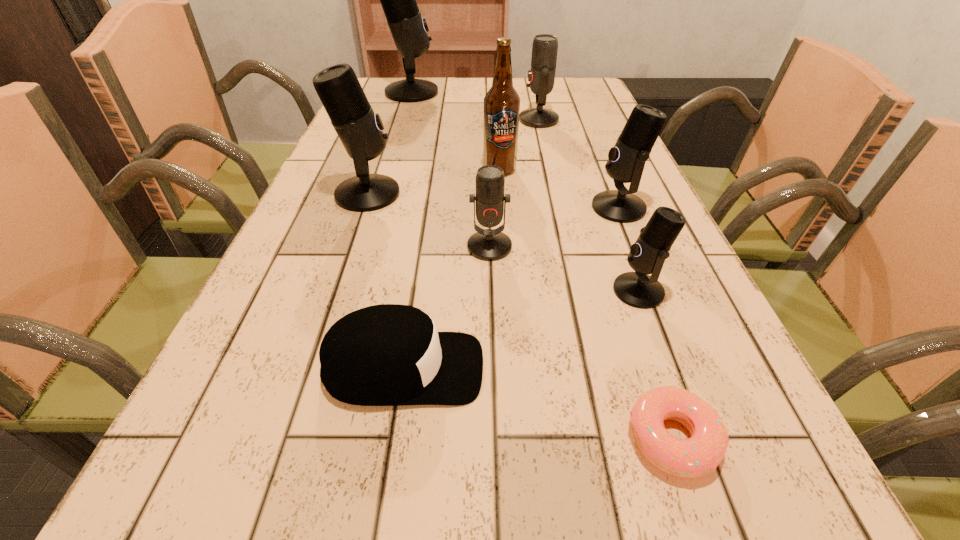
Where is `black microphone identified as the third closest to the cap`? The image size is (960, 540). black microphone identified as the third closest to the cap is located at coordinates (626, 160).

Where is `black microphone that is the third closest to the beer bottle`? The width and height of the screenshot is (960, 540). black microphone that is the third closest to the beer bottle is located at coordinates (647, 255).

Where is `vacant space that satisfies the following two spatial constraints: 1. on the stand of the nearest black microphone; 2. on the front side of the doughnut`? The height and width of the screenshot is (540, 960). vacant space that satisfies the following two spatial constraints: 1. on the stand of the nearest black microphone; 2. on the front side of the doughnut is located at coordinates [693, 438].

I want to click on blank space that satisfies the following two spatial constraints: 1. on the side of the second farthest microphone with the red ring; 2. on the label of the beer bottle, so click(x=550, y=170).

Where is `free point that satisfies the following two spatial constraints: 1. on the side of the doughnut with the red ring; 2. on the right side of the left red microphone`? free point that satisfies the following two spatial constraints: 1. on the side of the doughnut with the red ring; 2. on the right side of the left red microphone is located at coordinates (494, 438).

Locate an element on the screen. Image resolution: width=960 pixels, height=540 pixels. blank space that satisfies the following two spatial constraints: 1. on the side of the farther red microphone with the red ring; 2. on the side of the second nearest microphone with the red ring is located at coordinates (568, 247).

Locate an element on the screen. This screenshot has height=540, width=960. free spot that satisfies the following two spatial constraints: 1. on the label of the beer bottle; 2. on the stand of the fifth shortest microphone is located at coordinates (501, 194).

Where is `vacant region that satisfies the following two spatial constraints: 1. on the side of the nearer red microphone with the red ring; 2. on the left side of the doughnut`? Image resolution: width=960 pixels, height=540 pixels. vacant region that satisfies the following two spatial constraints: 1. on the side of the nearer red microphone with the red ring; 2. on the left side of the doughnut is located at coordinates (494, 438).

Where is `vacant point that satisfies the following two spatial constraints: 1. on the side of the fourth microphone from left to right with the red ring; 2. on the side of the nearer red microphone with the red ring`? The image size is (960, 540). vacant point that satisfies the following two spatial constraints: 1. on the side of the fourth microphone from left to right with the red ring; 2. on the side of the nearer red microphone with the red ring is located at coordinates (568, 247).